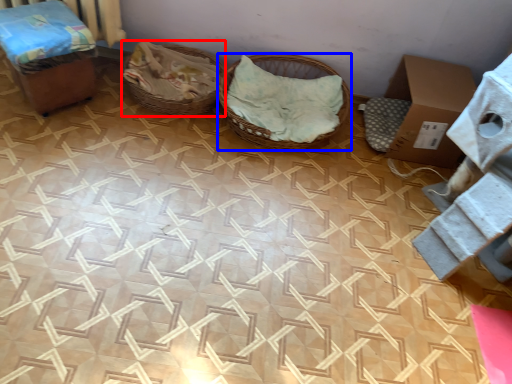
Question: Which of the following is the farthest to the observer, basket (highlighted by a red box) or basket (highlighted by a blue box)?

Choices:
 (A) basket
 (B) basket

Answer: (A)